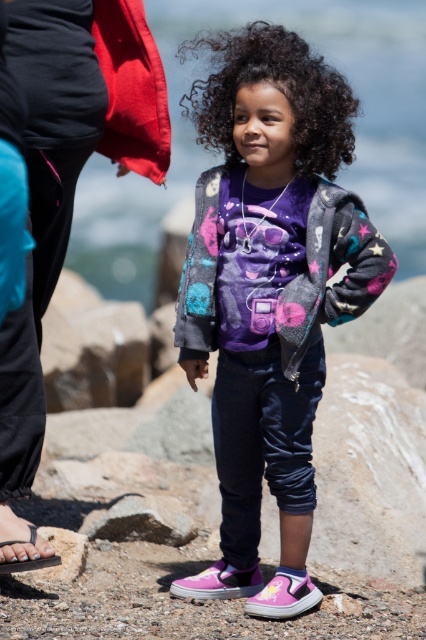
Does transparent water at center appear under gray rough rock at lower center?

Answer: Incorrect, transparent water at center is not positioned below gray rough rock at lower center.

Does transparent water at center have a larger size compared to gray rough rock at lower center?

Indeed, transparent water at center has a larger size compared to gray rough rock at lower center.

Find the location of a particular element. transparent water at center is located at coordinates (219, 157).

Is fuzzy gray jacket at center smaller than blue flip-flop at lower left?

Incorrect, fuzzy gray jacket at center is not smaller in size than blue flip-flop at lower left.

Is point (276, 497) closer to viewer compared to point (11, 540)?

No, (276, 497) is behind (11, 540).

At what (x,y) coordinates should I click in order to perform the action: click on fuzzy gray jacket at center. Please return your answer as a coordinate pair (x, y). Looking at the image, I should click on (270, 291).

Is point (213, 592) positioned after point (147, 260)?

No, it is in front of (147, 260).

Based on the photo, does fuzzy gray jacket at center have a smaller size compared to transparent water at center?

Correct, fuzzy gray jacket at center occupies less space than transparent water at center.

Identify the location of fuzzy gray jacket at center. (270, 291).

Find the location of `fuzzy gray jacket at center`. fuzzy gray jacket at center is located at coordinates (270, 291).